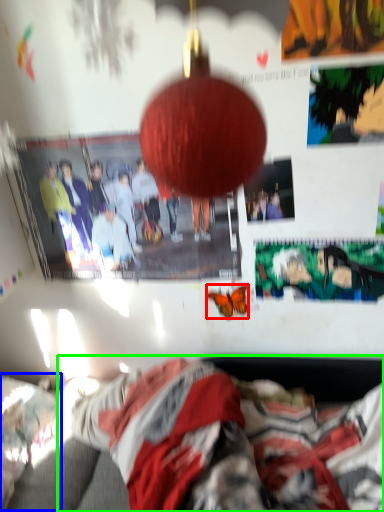
Question: Estimate the real-world distances between objects in this image. Which object is closer to butterfly (highlighted by a red box), bed (highlighted by a blue box) or person (highlighted by a green box)?

Choices:
 (A) bed
 (B) person

Answer: (B)